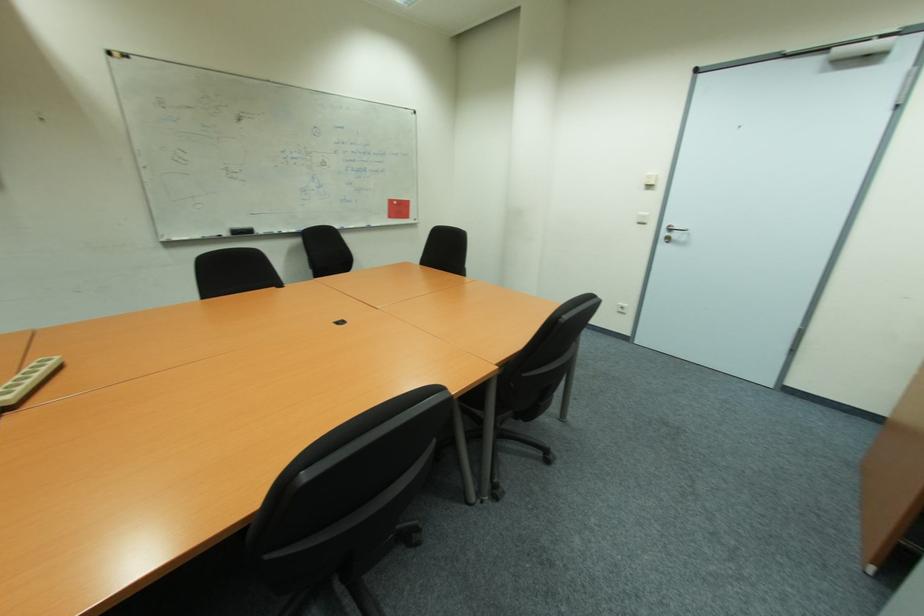
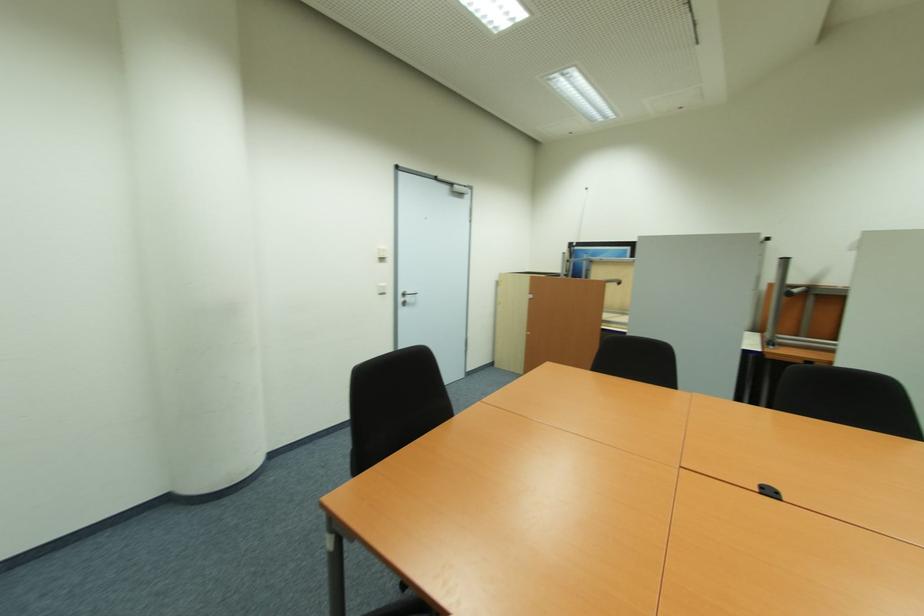
In the second image, find the point that corresponds to point (651, 188) in the first image.

(385, 260)